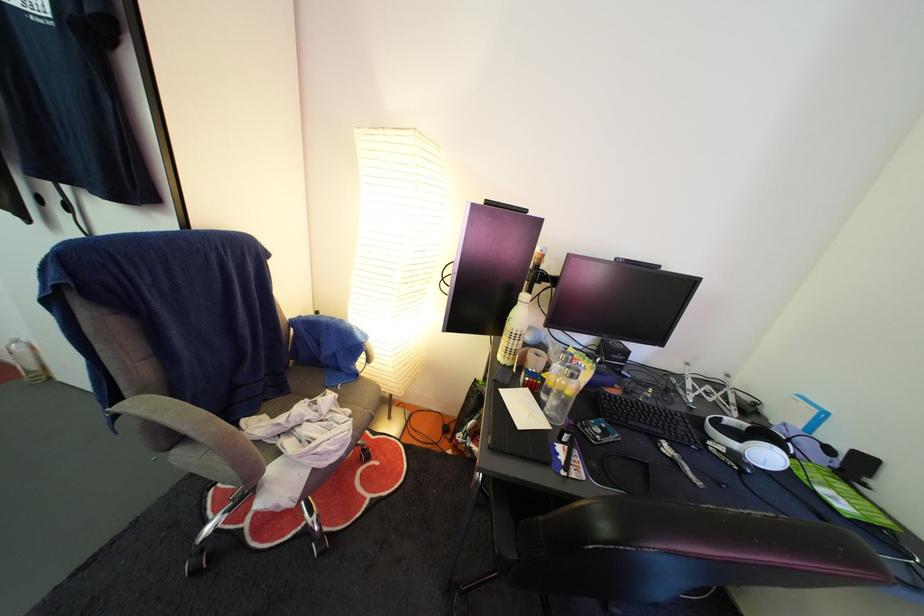
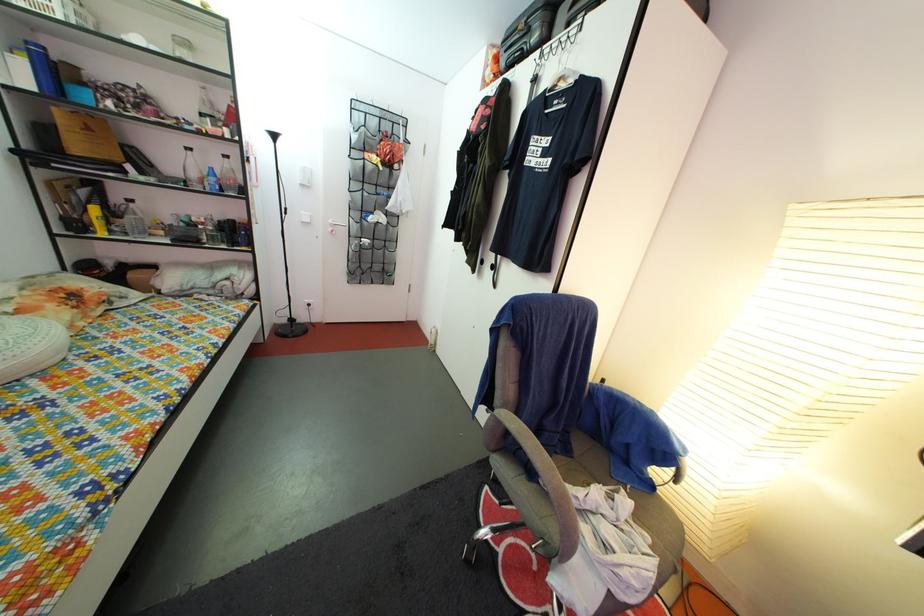
Question: The camera is either moving clockwise (left) or counter-clockwise (right) around the object. The first image is from the beginning of the video and the second image is from the end. Is the camera moving left or right when shooting the video?

Choices:
 (A) Left
 (B) Right

Answer: (B)